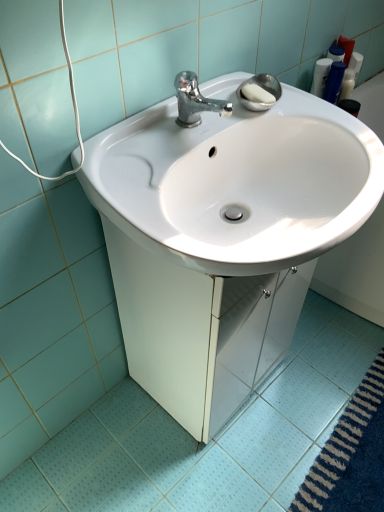
Question: Is white glossy sink at center bigger or smaller than white glossy sink at center?

Choices:
 (A) small
 (B) big

Answer: (A)

Question: Looking at their shapes, would you say white glossy sink at center is wider or thinner than white glossy sink at center?

Choices:
 (A) wide
 (B) thin

Answer: (B)

Question: Which object is positioned farthest from the white glossy sink at center?

Choices:
 (A) chrome metallic faucet at upper center
 (B) white glossy sink at center
 (C) white glossy ceramic tile at lower center

Answer: (B)

Question: Based on their relative distances, which object is farther from the white glossy sink at center?

Choices:
 (A) chrome metallic faucet at upper center
 (B) white glossy sink at center
 (C) white glossy ceramic tile at lower center

Answer: (B)